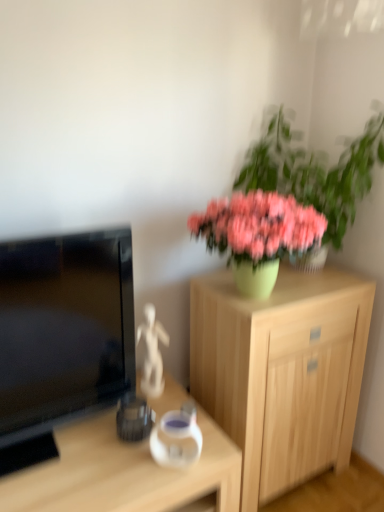
The image size is (384, 512). Identify the location of blank space situated above matte wood desk at lower left (from a real-world perspective). (99, 460).